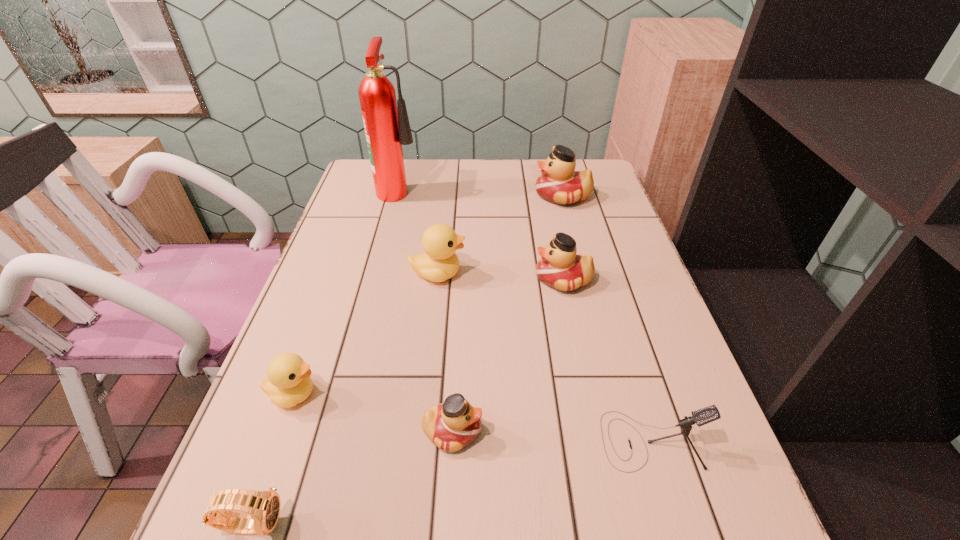
Where is `object at the far left corner`? The width and height of the screenshot is (960, 540). object at the far left corner is located at coordinates (387, 128).

The image size is (960, 540). What are the coordinates of `object that is at the far right corner` in the screenshot? It's located at (559, 183).

The height and width of the screenshot is (540, 960). What are the coordinates of `free space at the far edge` in the screenshot? It's located at (436, 181).

You are a GUI agent. You are given a task and a screenshot of the screen. Output one action in this format:
    pyautogui.click(x=<x>, y=<y>)
    Task: Click on the free space at the left edge
    This screenshot has width=960, height=540.
    Given the screenshot: What is the action you would take?
    pyautogui.click(x=334, y=388)

Identify the location of free region at the right edge. (718, 467).

You are a GUI agent. You are given a task and a screenshot of the screen. Output one action in this format:
    pyautogui.click(x=<x>, y=<y>)
    Task: Click on the free space between the fire extinguisher and the bigger yellow duck
    The height and width of the screenshot is (540, 960).
    Given the screenshot: What is the action you would take?
    pyautogui.click(x=419, y=231)

I want to click on free space between the second smallest red duck and the microphone, so click(607, 360).

Image resolution: width=960 pixels, height=540 pixels. In order to click on free space between the nearer yellow duck and the fire extinguisher in this screenshot , I will do `click(347, 292)`.

At what (x,y) coordinates should I click in order to perform the action: click on unoccupied area between the second nearest red duck and the microphone. Please return your answer as a coordinate pair (x, y). The image size is (960, 540). Looking at the image, I should click on (607, 360).

Find the location of a particular element. free spot between the nearest red duck and the fire extinguisher is located at coordinates (426, 310).